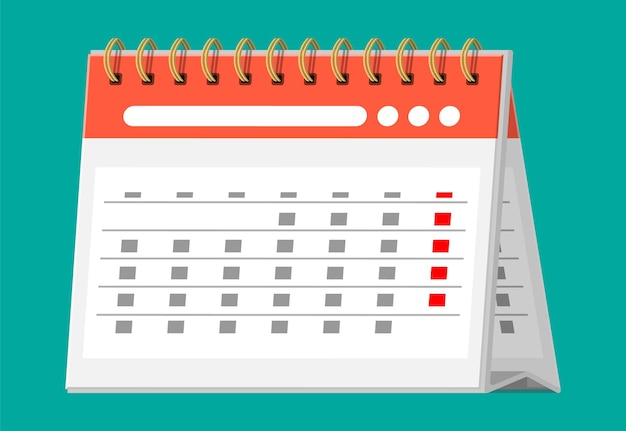
You are a GUI agent. You are given a task and a screenshot of the screen. Output one action in this format:
    pyautogui.click(x=<x>, y=<y>)
    Task: Click on the red boxes on the calendar
    The image size is (626, 431).
    Given the screenshot: What is the action you would take?
    pyautogui.click(x=444, y=194), pyautogui.click(x=439, y=219), pyautogui.click(x=442, y=244), pyautogui.click(x=436, y=273), pyautogui.click(x=438, y=299)